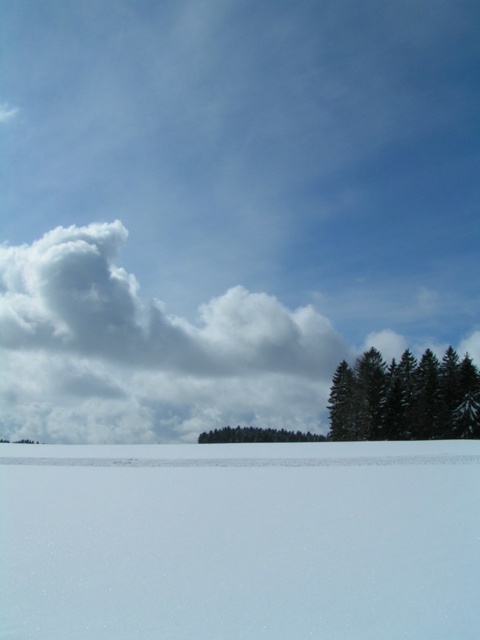
Question: Is green matte trees at lower right smaller than green matte trees at center?

Choices:
 (A) yes
 (B) no

Answer: (A)

Question: Which object appears farthest from the camera in this image?

Choices:
 (A) white smooth snow at bottom
 (B) green matte trees at center

Answer: (B)

Question: Which point appears farthest from the camera in this image?

Choices:
 (A) (371, 358)
 (B) (239, 435)

Answer: (B)

Question: Is white smooth snow at bottom behind green matte trees at lower right?

Choices:
 (A) no
 (B) yes

Answer: (A)

Question: Which point is closer to the camera?

Choices:
 (A) (308, 493)
 (B) (404, 369)

Answer: (A)

Question: Is white smooth snow at bottom bigger than green matte trees at lower right?

Choices:
 (A) no
 (B) yes

Answer: (A)